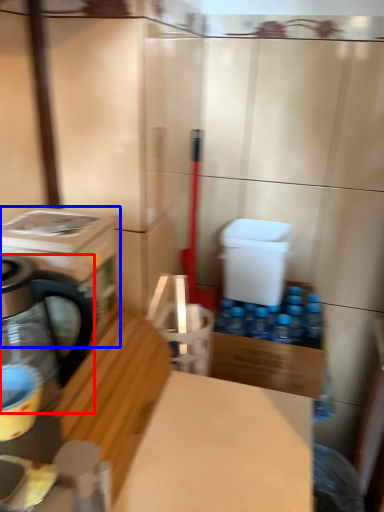
Question: Among these objects, which one is farthest to the camera, kitchen appliance (highlighted by a red box) or washing machine (highlighted by a blue box)?

Choices:
 (A) kitchen appliance
 (B) washing machine

Answer: (B)